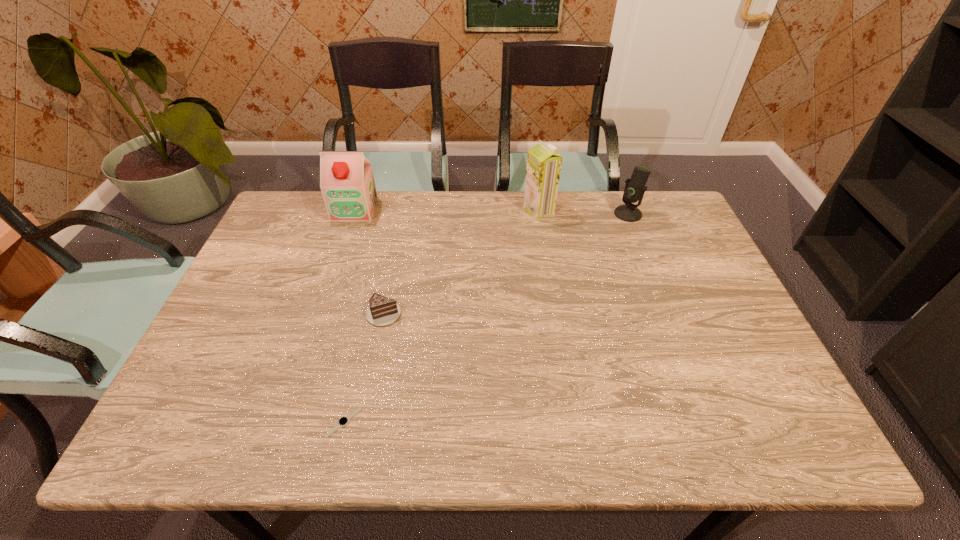
Locate an element on the screen. vacant space located 0.290m on the front of the third tallest object is located at coordinates click(x=657, y=288).

You are a GUI agent. You are given a task and a screenshot of the screen. Output one action in this format:
    pyautogui.click(x=<x>, y=<y>)
    Task: Click on the vacant region located on the front of the second shortest object
    This screenshot has height=540, width=960.
    Given the screenshot: What is the action you would take?
    pos(358,439)

Find the location of a particular element. This screenshot has height=540, width=960. free region located on the right of the nearest object is located at coordinates (441, 422).

Locate an element on the screen. This screenshot has height=540, width=960. microphone present at the far edge is located at coordinates (635, 188).

This screenshot has height=540, width=960. Find the location of `object that is at the near edge`. object that is at the near edge is located at coordinates (343, 421).

Where is `object that is at the right edge`? object that is at the right edge is located at coordinates (635, 188).

Find the location of `object that is at the far right corner`. object that is at the far right corner is located at coordinates (635, 188).

In the image, there is a desktop. Identify the location of free space at the far edge. The image size is (960, 540). (362, 231).

Find the location of a particular element. vacant area at the near edge is located at coordinates (284, 433).

This screenshot has width=960, height=540. In the image, there is a desktop. In order to click on free region at the left edge in this screenshot , I will do `click(308, 241)`.